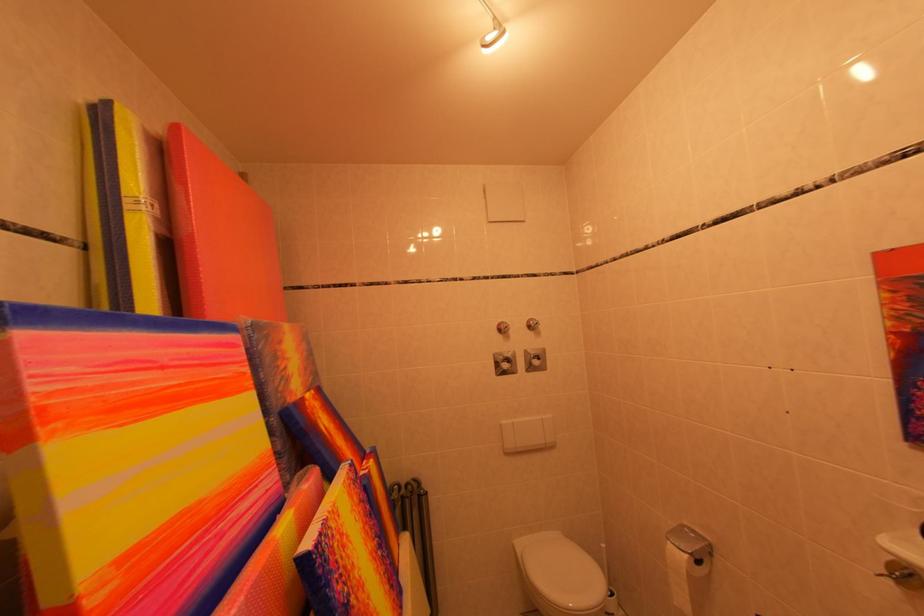
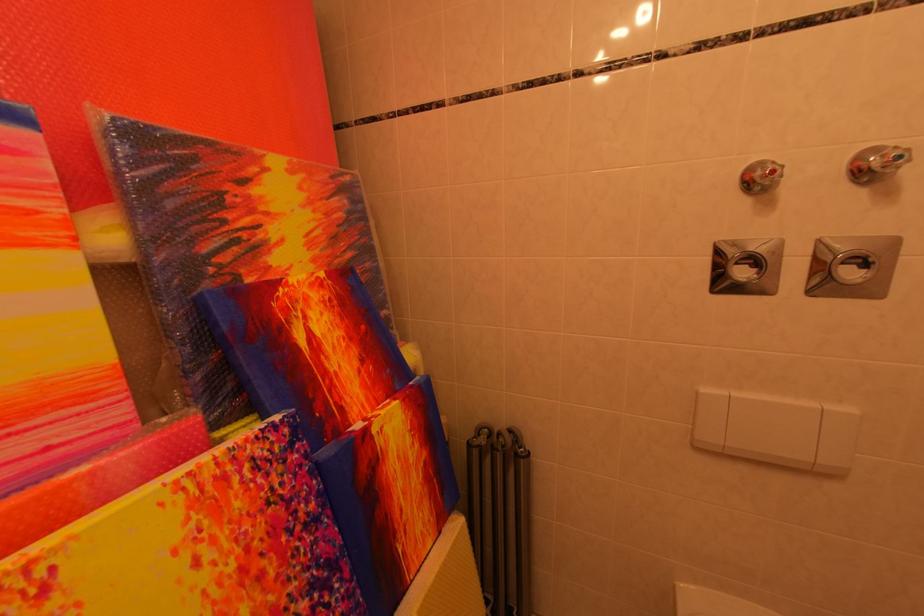
The first image is from the beginning of the video and the second image is from the end. How did the camera likely rotate when shooting the video?

The camera rotated toward left-down.